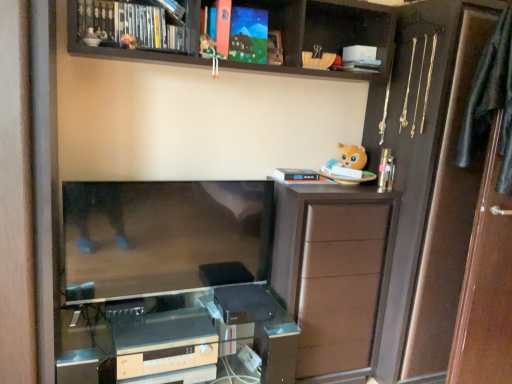
Identify the location of blank space situated above silver metallic stereo at lower center, positioned as the second appliance in right-to-left order (from a real-world perspective). (177, 334).